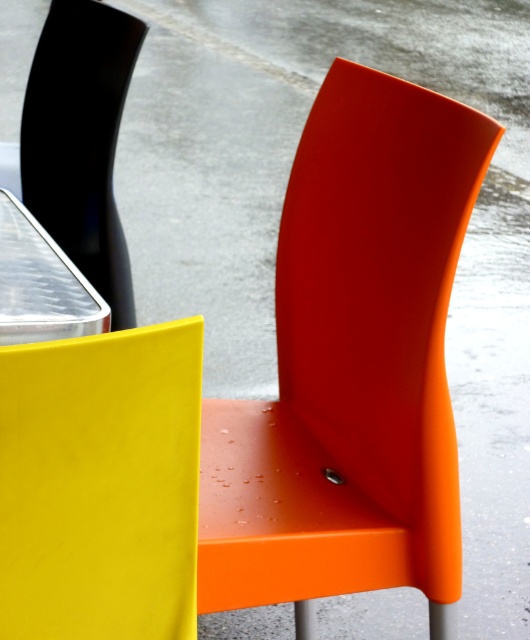
You are a delivery person trying to place a large box between the orange matte chair at center and the matte yellow chair at left. The box is 40 centimeters wide. Can the box fit between them?

The orange matte chair at center is 39.88 centimeters from the matte yellow chair at left, so the box cannot fit between them as the distance is slightly less than the box width.

You are a customer at an outdoor cafe and want to sit on the matte yellow chair at left and the matte black chair at left. Based on their positions, which chair would you need to step down from the other to reach?

The matte yellow chair at left is below the matte black chair at left, so you would need to step down from the matte black chair at left to reach the matte yellow chair at left.

You are a delivery person trying to place a large box between the matte yellow chair at left and the matte black chair at left. The box is 1.2 meters wide. Can you fit the box between them?

The distance between the matte yellow chair at left and the matte black chair at left is 1.10 meters, which is shorter than the box width of 1.2 meters. Therefore, the box cannot fit between them.